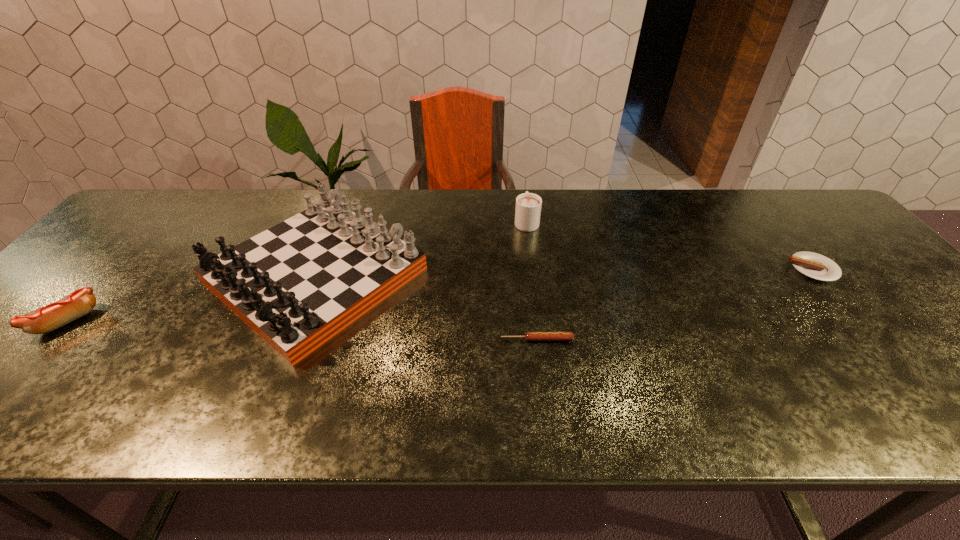
Identify the location of blank space at the far edge of the desktop. (504, 231).

In the image, there is a desktop. Find the location of `free region at the near edge`. free region at the near edge is located at coordinates (702, 413).

The image size is (960, 540). In the image, there is a desktop. In order to click on vacant space at the left edge in this screenshot , I will do `click(151, 256)`.

You are a GUI agent. You are given a task and a screenshot of the screen. Output one action in this format:
    pyautogui.click(x=<x>, y=<y>)
    Task: Click on the free space at the right edge
    Image resolution: width=960 pixels, height=540 pixels.
    Given the screenshot: What is the action you would take?
    pyautogui.click(x=816, y=238)

In the image, there is a desktop. Where is `vacant space at the near left corner`? The image size is (960, 540). vacant space at the near left corner is located at coordinates (8, 405).

Where is `free location at the near right corner of the desktop`? This screenshot has height=540, width=960. free location at the near right corner of the desktop is located at coordinates (958, 420).

You are a GUI agent. You are given a task and a screenshot of the screen. Output one action in this format:
    pyautogui.click(x=<x>, y=<y>)
    Task: Click on the free area in between the tallest object and the shortest object
    This screenshot has width=960, height=540.
    Given the screenshot: What is the action you would take?
    pyautogui.click(x=426, y=307)

Locate an element on the screen. The image size is (960, 540). free space between the second object from left to right and the tallest sausage is located at coordinates (192, 298).

Find the location of a particular element. free spot between the second tallest object and the shortest object is located at coordinates (532, 280).

The width and height of the screenshot is (960, 540). I want to click on vacant space in between the gameboard and the fourth tallest object, so click(x=564, y=272).